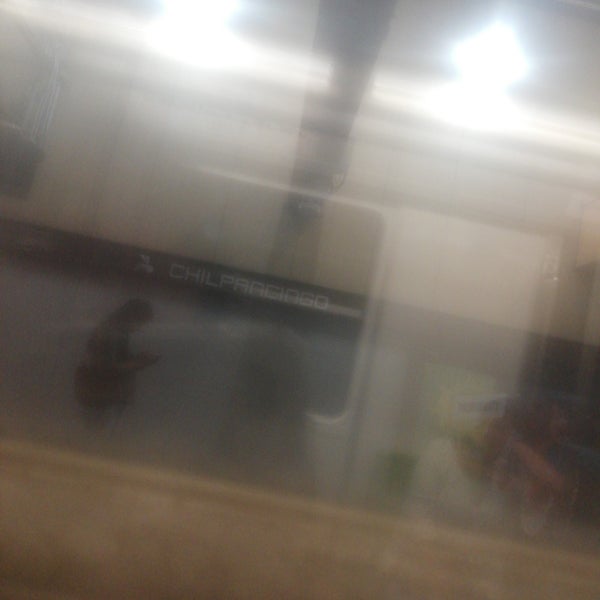
Image resolution: width=600 pixels, height=600 pixels. I want to click on light, so click(476, 51).